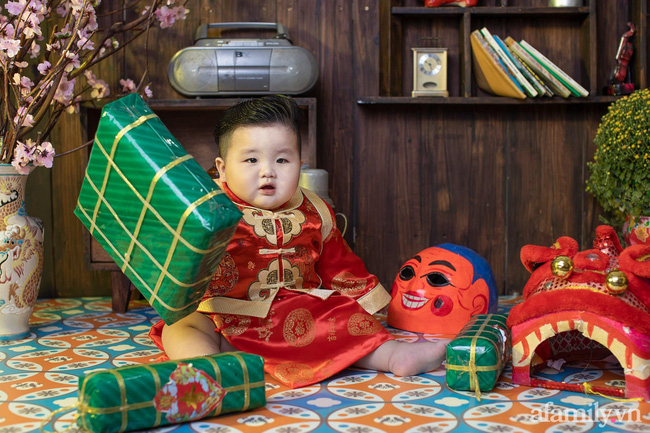
The width and height of the screenshot is (650, 433). I want to click on clock, so click(x=430, y=70).